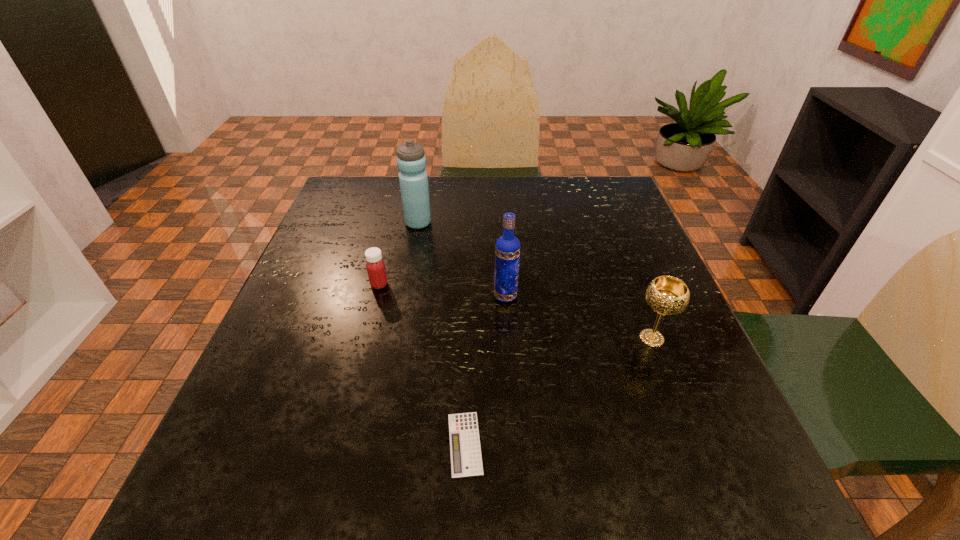
What are the coordinates of `the second object from left to right` in the screenshot? It's located at (411, 161).

Where is `water bottle`? water bottle is located at coordinates (411, 161).

At what (x,y) coordinates should I click in order to perform the action: click on vodka. Please return your answer as a coordinate pair (x, y). The width and height of the screenshot is (960, 540). Looking at the image, I should click on (507, 249).

At what (x,y) coordinates should I click in order to perform the action: click on the rightmost object. Please return your answer as a coordinate pair (x, y). This screenshot has width=960, height=540. Looking at the image, I should click on (666, 295).

I want to click on chalice, so click(x=666, y=295).

This screenshot has width=960, height=540. Find the location of `medicine`. medicine is located at coordinates (375, 265).

Where is `the second shortest object`? The image size is (960, 540). the second shortest object is located at coordinates (375, 265).

Find the location of a particular element. Image resolution: width=960 pixels, height=540 pixels. calculator is located at coordinates point(465,450).

Find the location of `the shortest object`. the shortest object is located at coordinates pos(465,450).

The width and height of the screenshot is (960, 540). Identify the location of free spot located 0.400m on the front of the water bottle. (393, 357).